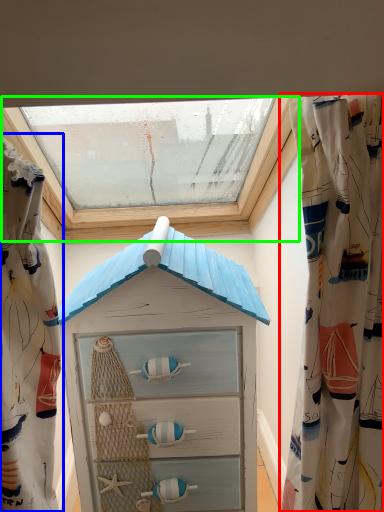
Question: Which object is the farthest from curtain (highlighted by a red box)? Choose among these: curtain (highlighted by a blue box) or window (highlighted by a green box).

Choices:
 (A) curtain
 (B) window

Answer: (B)